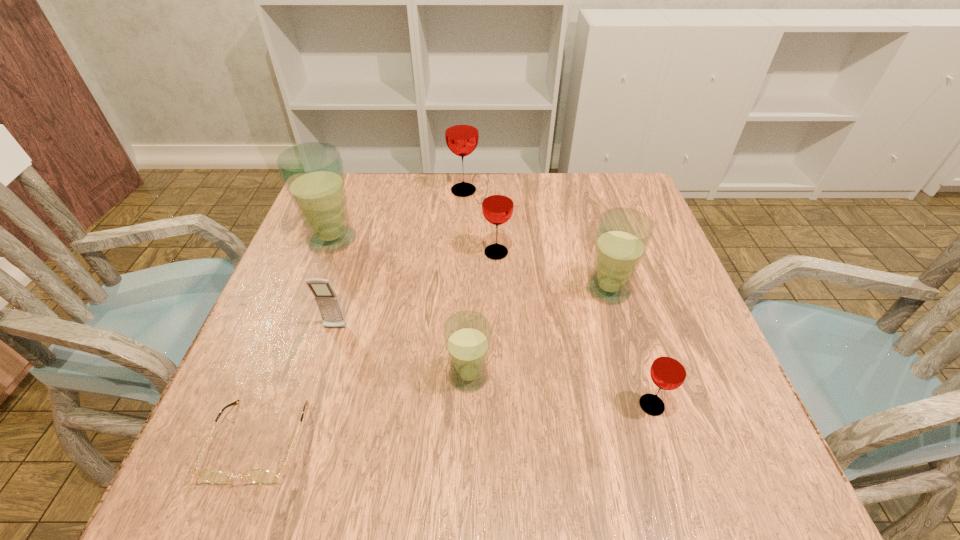
Locate an element on the screen. This screenshot has width=960, height=540. free point located 0.080m on the front-facing side of the gray cellular telephone is located at coordinates (324, 366).

The image size is (960, 540). Identify the location of vacant region located on the right of the nearest blue glass. (601, 376).

You are a GUI agent. You are given a task and a screenshot of the screen. Output one action in this format:
    pyautogui.click(x=<x>, y=<y>)
    Task: Click on the free space located on the back of the nearest red glass
    
    Given the screenshot: What is the action you would take?
    pyautogui.click(x=617, y=293)

Where is `object situated at the near edge`? object situated at the near edge is located at coordinates (258, 476).

This screenshot has height=540, width=960. What are the coordinates of `glass situated at the left edge` in the screenshot? It's located at (313, 173).

The image size is (960, 540). What are the coordinates of `cellular telephone at the left edge` in the screenshot? It's located at (327, 301).

Locate an element on the screen. spectacles present at the left edge is located at coordinates (258, 476).

Locate an element on the screen. object located at the far left corner is located at coordinates (313, 173).

Find the location of a particular element. The width and height of the screenshot is (960, 540). object that is positioned at the near left corner is located at coordinates (258, 476).

The height and width of the screenshot is (540, 960). In the image, there is a desktop. Find the location of `vacant space at the far edge`. vacant space at the far edge is located at coordinates (443, 224).